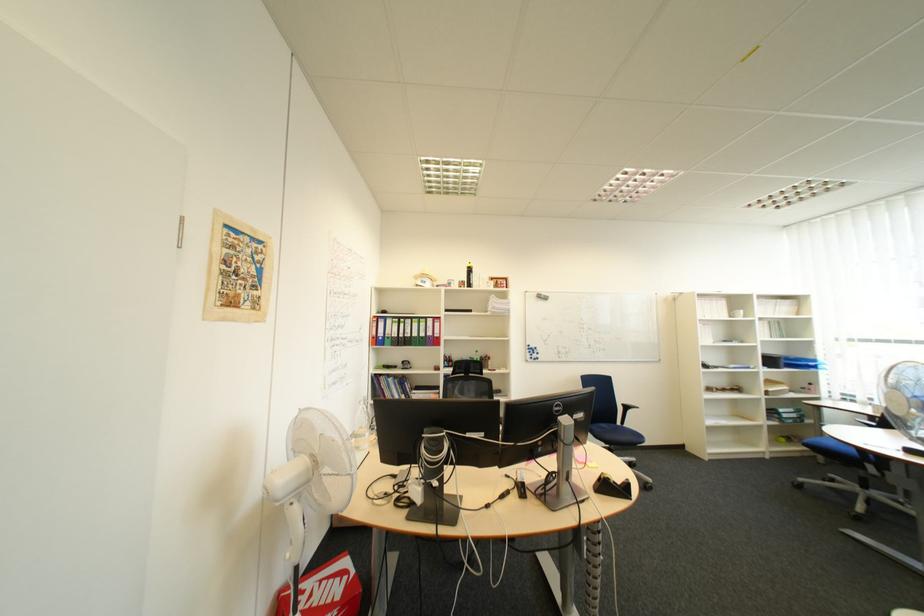
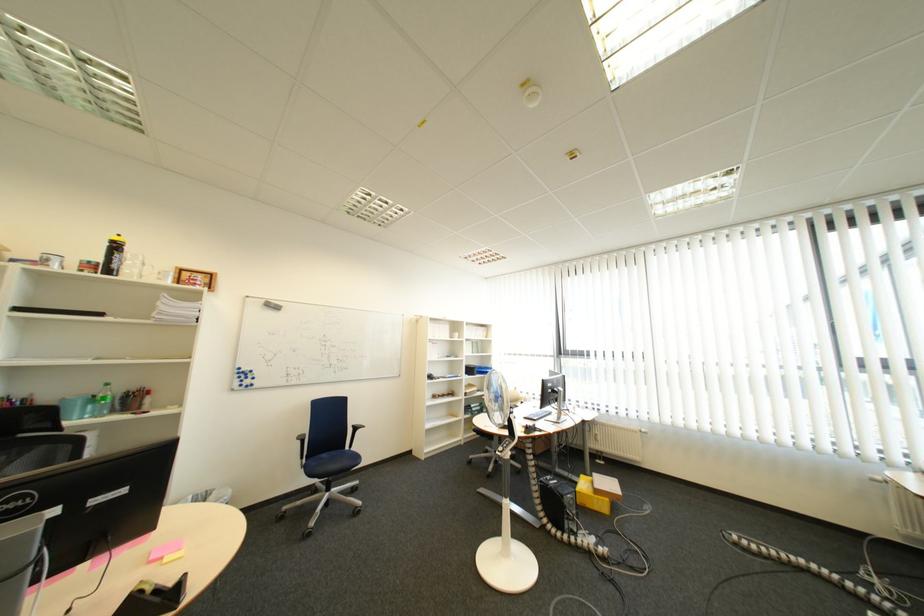
In the second image, find the point that corresponds to the point at 475,285 in the first image.

(102, 267)